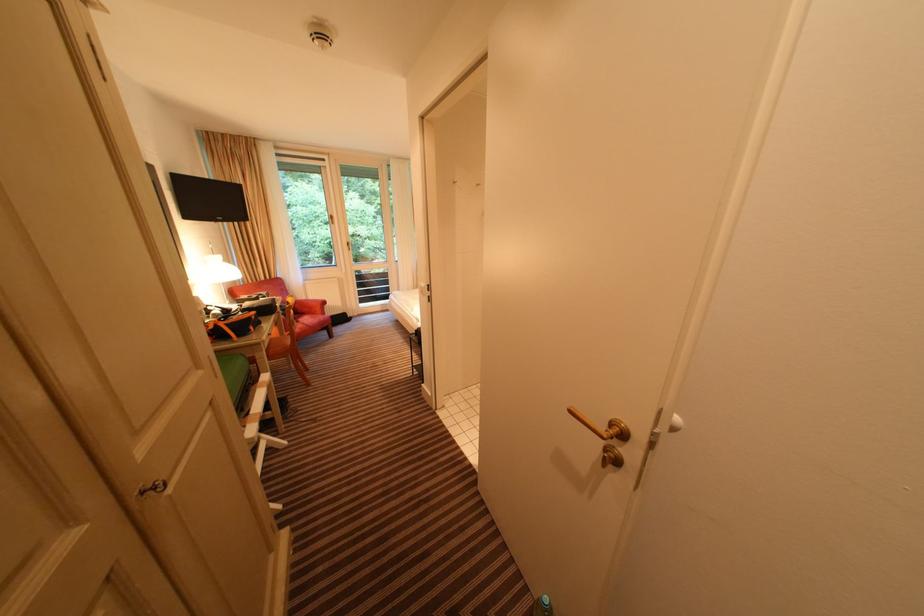
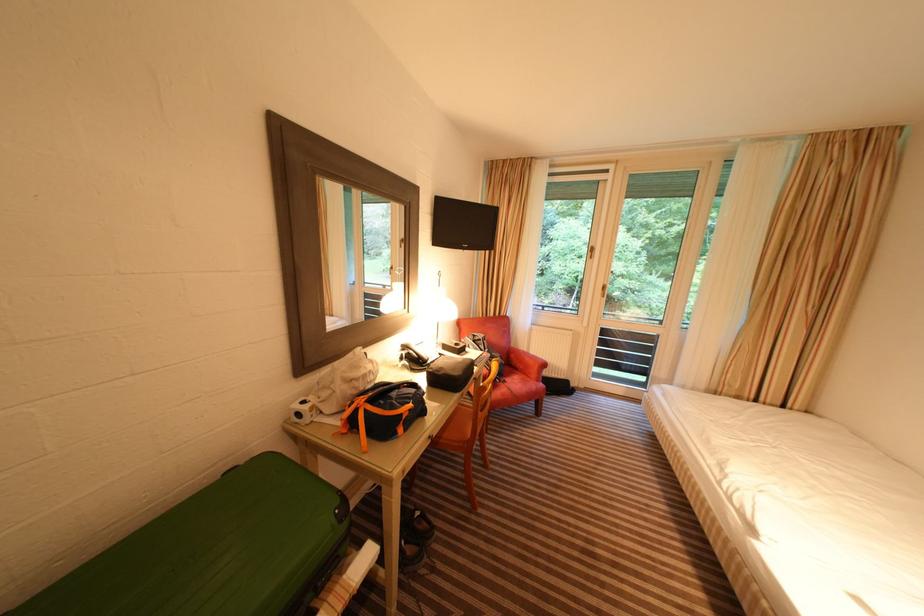
Where in the second image is the point corresponding to [305,323] from the first image?

(512, 384)